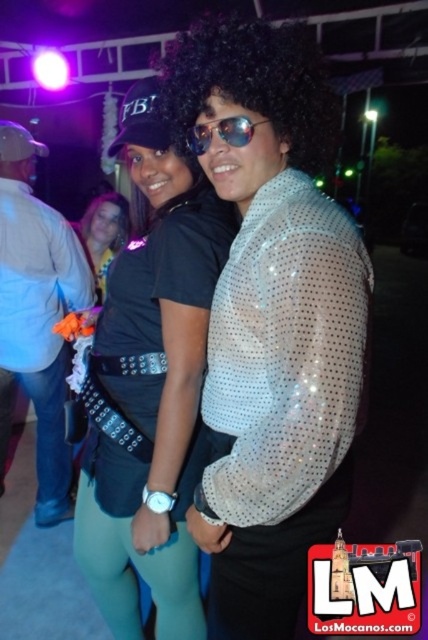
You are a photographer at this event and want to capture a clear photo of both the shiny sequined shirt at center and the matte black top at center. Since the camera can only focus on one object at a time, which one should you choose to ensure the other is still somewhat in focus?

You should focus on the shiny sequined shirt at center because it is closer to the viewer than the matte black top at center. By focusing on the closer object, the depth of field may still allow the matte black top at center to be partially in focus.

You are a photographer trying to focus on the point at coordinates (152,385) in the image. Based on the scene description, what object or part of clothing is located at that point?

The point at coordinates (152,385) is located on the matte black shirt at center.

You are standing at the center of the scene and want to take a photo of the point at coordinates point (x=273, y=208). If your camera has a focal length of 50mm and you want to ensure the point is in focus, what is the minimum distance you should be from the point?

The point at coordinates point (x=273, y=208) is 1.02 meters away from the viewer. To ensure it is in focus, you should be at least 1.02 meters away from the point.